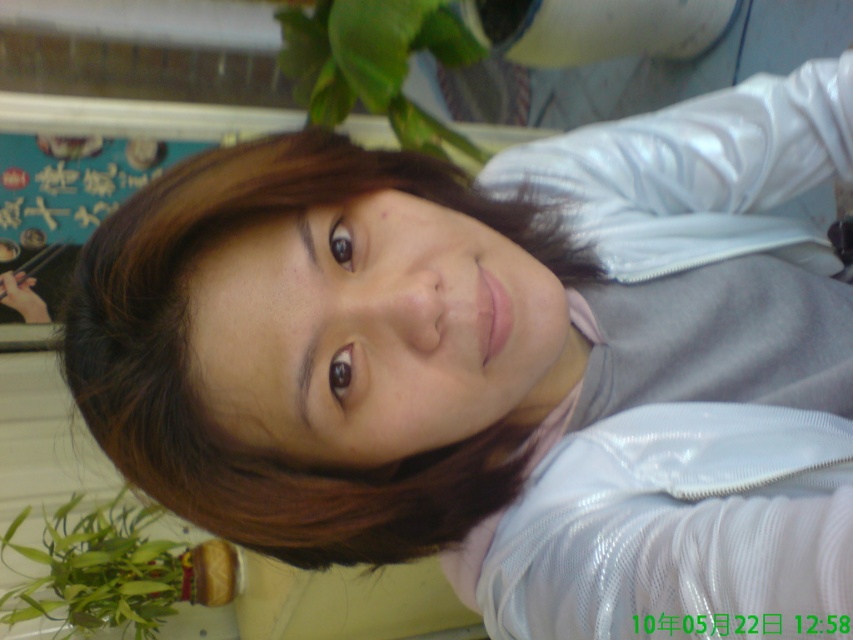
Question: Considering the relative positions of brown shiny hair at upper center and green leafy plant at upper center in the image provided, where is brown shiny hair at upper center located with respect to green leafy plant at upper center?

Choices:
 (A) below
 (B) above

Answer: (A)

Question: Which point is farther from the camera taking this photo?

Choices:
 (A) (172, 604)
 (B) (392, 40)

Answer: (A)

Question: Which is nearer to the brown shiny hair at upper center?

Choices:
 (A) green leafy plant at upper center
 (B) green leafy plant at lower left

Answer: (A)

Question: Which of the following is the closest to the observer?

Choices:
 (A) (442, 58)
 (B) (97, 532)

Answer: (A)

Question: Is brown shiny hair at upper center to the left of green leafy plant at lower left from the viewer's perspective?

Choices:
 (A) no
 (B) yes

Answer: (A)

Question: Is brown shiny hair at upper center to the right of green leafy plant at upper center from the viewer's perspective?

Choices:
 (A) yes
 (B) no

Answer: (A)